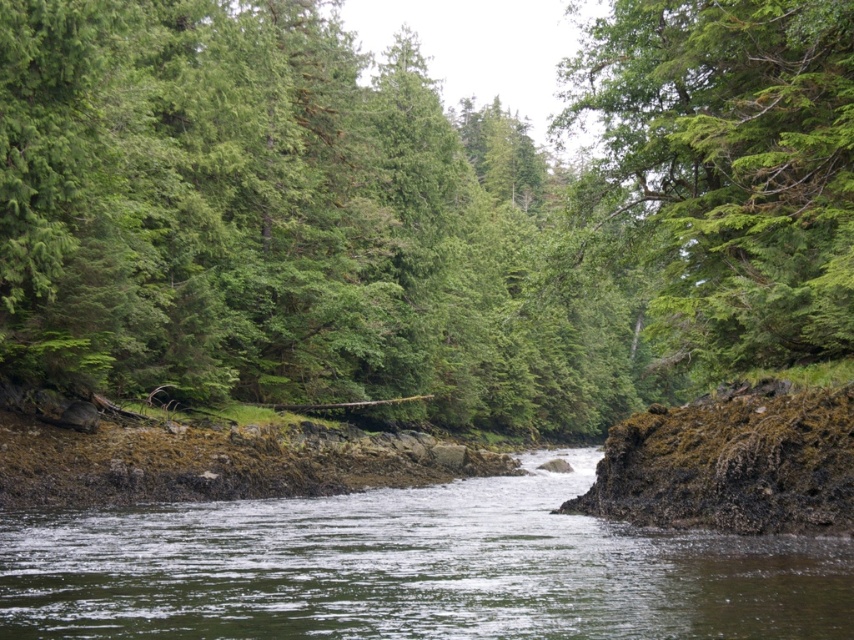
Question: Can you confirm if green leafy tree at center is bigger than green leafy tree at upper center?

Choices:
 (A) yes
 (B) no

Answer: (A)

Question: Considering the real-world distances, which object is farthest from the green leafy tree at center?

Choices:
 (A) green mossy rock at center
 (B) green leafy tree at upper center

Answer: (B)

Question: Considering the real-world distances, which object is closest to the green mossy rock at center?

Choices:
 (A) green leafy tree at center
 (B) green leafy tree at upper center

Answer: (B)

Question: Which object appears farthest from the camera in this image?

Choices:
 (A) green leafy tree at center
 (B) green leafy tree at upper center

Answer: (A)

Question: Is green leafy tree at center to the left of green leafy tree at upper center from the viewer's perspective?

Choices:
 (A) yes
 (B) no

Answer: (A)

Question: Is green leafy tree at center positioned before green mossy rock at center?

Choices:
 (A) yes
 (B) no

Answer: (B)